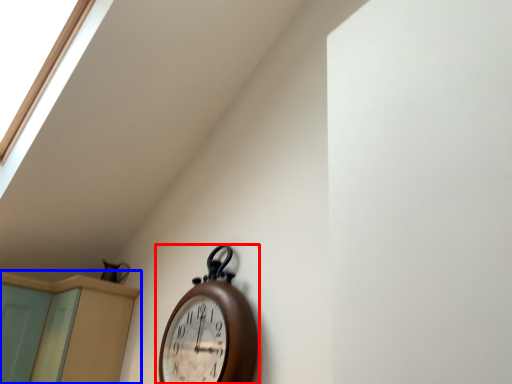
Question: Which object appears farthest to the camera in this image, wall clock (highlighted by a red box) or dresser (highlighted by a blue box)?

Choices:
 (A) wall clock
 (B) dresser

Answer: (B)